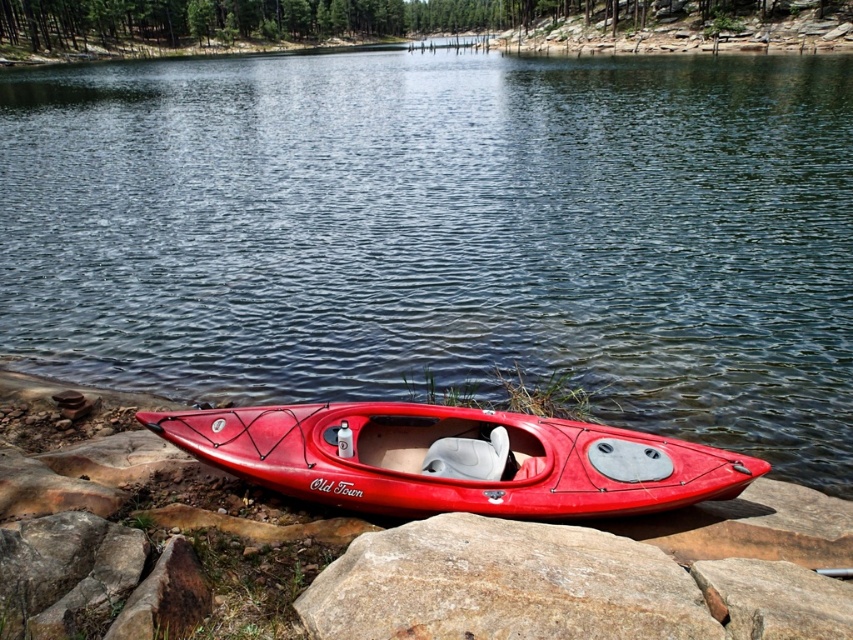
Question: Does clear water at center come behind smooth plastic seat at center?

Choices:
 (A) no
 (B) yes

Answer: (B)

Question: Observing the image, what is the correct spatial positioning of clear water at center in reference to smooth plastic seat at center?

Choices:
 (A) above
 (B) below

Answer: (A)

Question: Which of these objects is positioned closest to the shiny red kayak at lower center?

Choices:
 (A) smooth gray rock at lower center
 (B) smooth plastic seat at center
 (C) clear water at center

Answer: (B)

Question: Among these objects, which one is nearest to the camera?

Choices:
 (A) smooth plastic seat at center
 (B) smooth gray rock at lower center
 (C) shiny red kayak at lower center
 (D) clear water at center

Answer: (B)

Question: Does smooth gray rock at lower center have a lesser width compared to smooth plastic seat at center?

Choices:
 (A) yes
 (B) no

Answer: (B)

Question: Which object appears closest to the camera in this image?

Choices:
 (A) smooth plastic seat at center
 (B) smooth gray rock at lower center
 (C) clear water at center
 (D) shiny red kayak at lower center

Answer: (B)